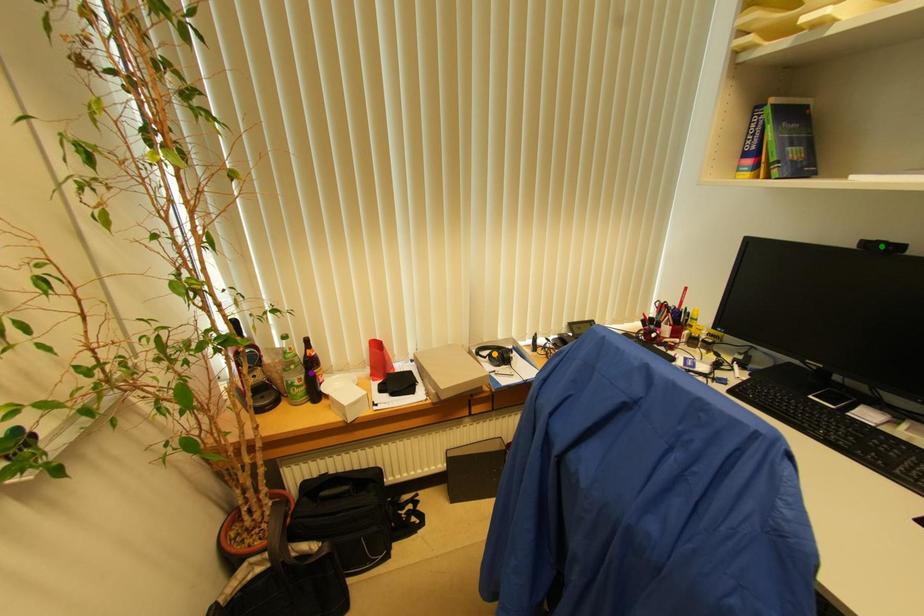
Order these from farthest to nearest:
purple point | orange point | green point

orange point < purple point < green point